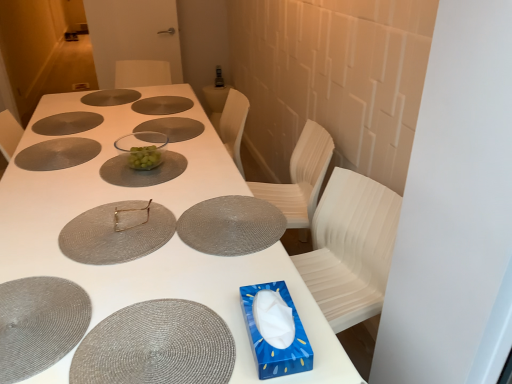
In order to click on vacant space to the right of matte gray glass plate at upper left, which is the 5th glass plate in back-to-front order in this screenshot , I will do `click(116, 149)`.